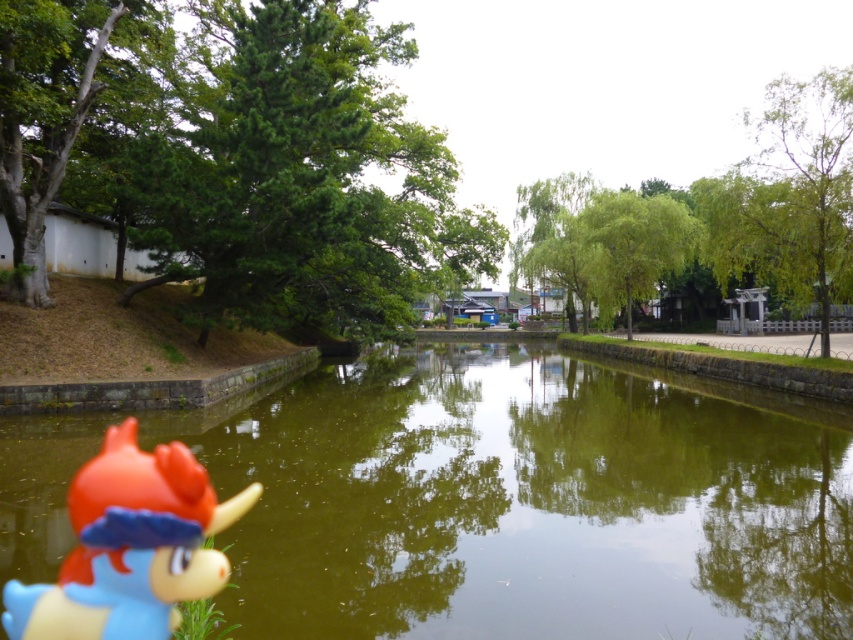
Question: Can you confirm if green reflective water at center is thinner than rubber duck at lower left?

Choices:
 (A) no
 (B) yes

Answer: (A)

Question: Is green reflective water at center bigger than rubber duck at lower left?

Choices:
 (A) no
 (B) yes

Answer: (B)

Question: Which object is farther from the camera taking this photo?

Choices:
 (A) green reflective water at center
 (B) rubber duck at lower left

Answer: (A)

Question: Which point is farther to the camera?

Choices:
 (A) green reflective water at center
 (B) rubber duck at lower left

Answer: (A)

Question: Where is green reflective water at center located in relation to rubber duck at lower left in the image?

Choices:
 (A) above
 (B) below

Answer: (B)

Question: Which point is closer to the camera?

Choices:
 (A) (164, 592)
 (B) (477, 582)

Answer: (A)